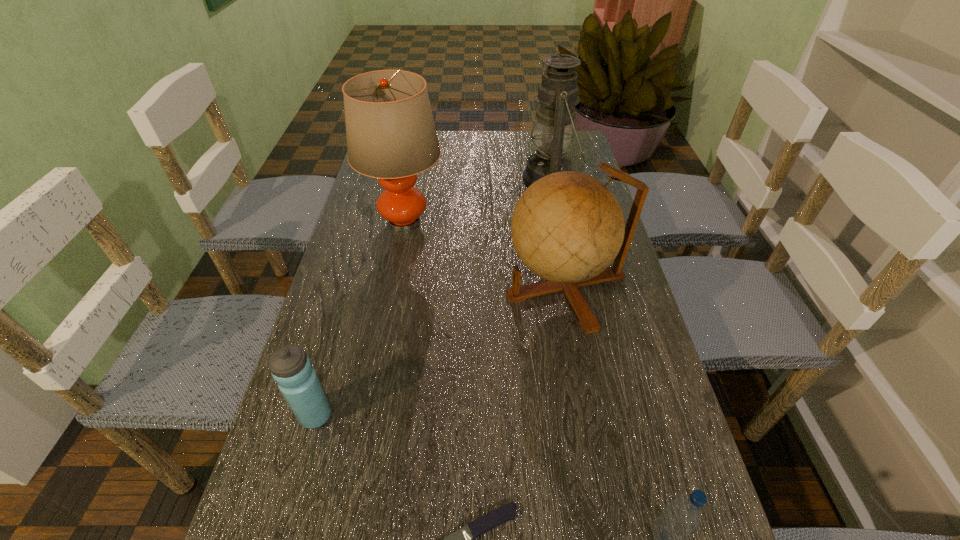
You are a GUI agent. You are given a task and a screenshot of the screen. Output one action in this format:
    pyautogui.click(x=<x>, y=<y>)
    Task: Click on the vacant area between the third shortest object and the globe
    The image size is (960, 540).
    Given the screenshot: What is the action you would take?
    pyautogui.click(x=441, y=350)

Where is `object that is the fifth closest one to the oil lamp`? This screenshot has width=960, height=540. object that is the fifth closest one to the oil lamp is located at coordinates (683, 515).

Where is `object that ranks as the fourth closest to the lamp`? The width and height of the screenshot is (960, 540). object that ranks as the fourth closest to the lamp is located at coordinates (461, 539).